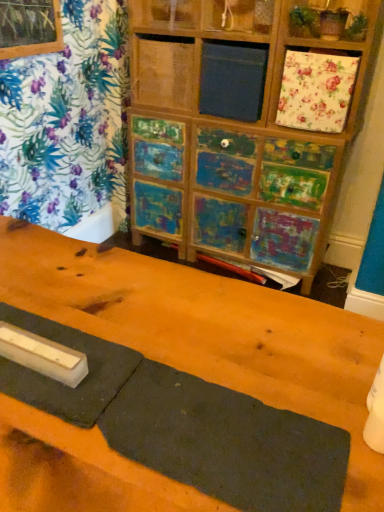
What is the approximate width of dark gray rubber mat at center?

dark gray rubber mat at center is 31.99 inches wide.

Where is `dark gray rubber mat at center`? The height and width of the screenshot is (512, 384). dark gray rubber mat at center is located at coordinates (210, 332).

Describe the element at coordinates (210, 332) in the screenshot. I see `dark gray rubber mat at center` at that location.

Locate an element on the screen. The height and width of the screenshot is (512, 384). dark gray rubber mat at center is located at coordinates (210, 332).